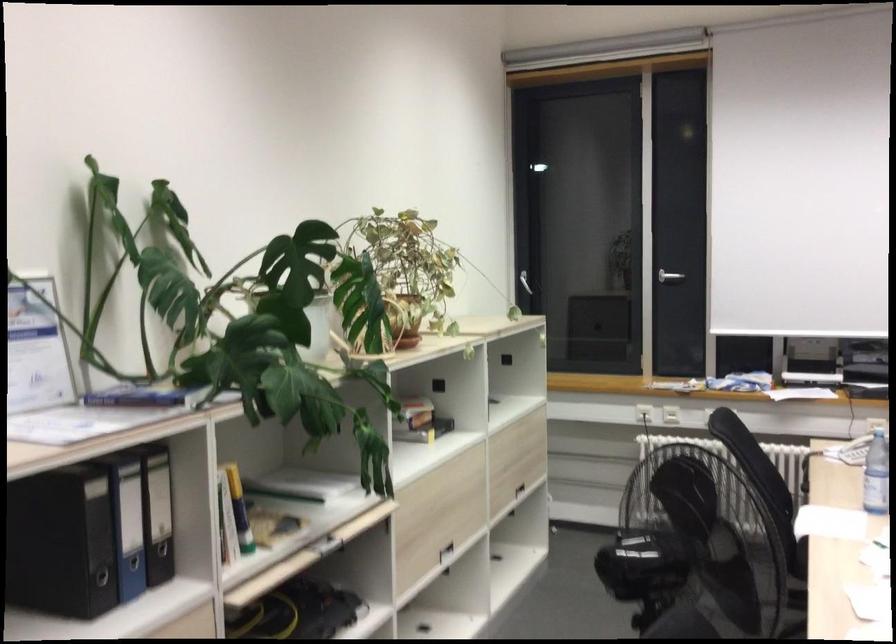
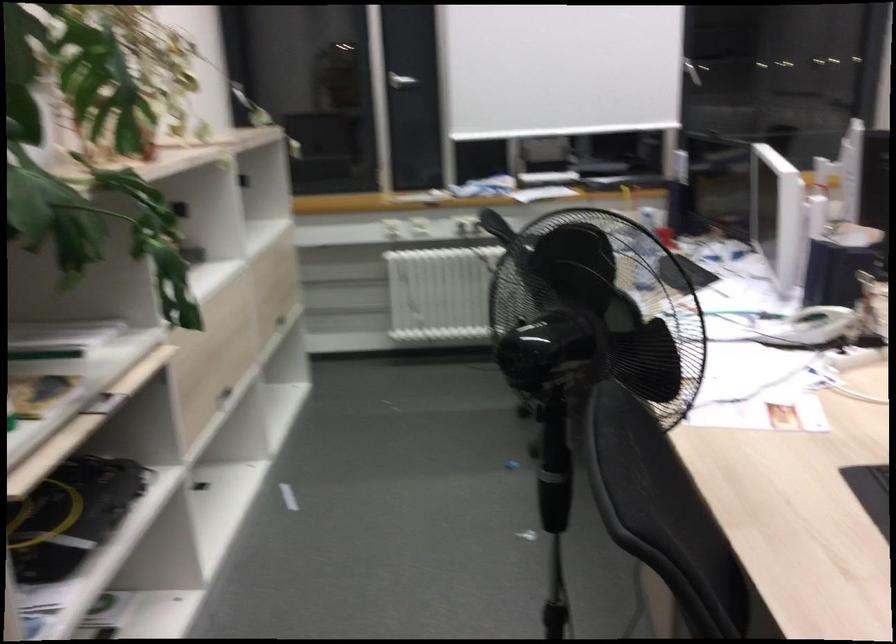
Find the pixel in the second image that matches (511,482) in the first image.

(276, 313)